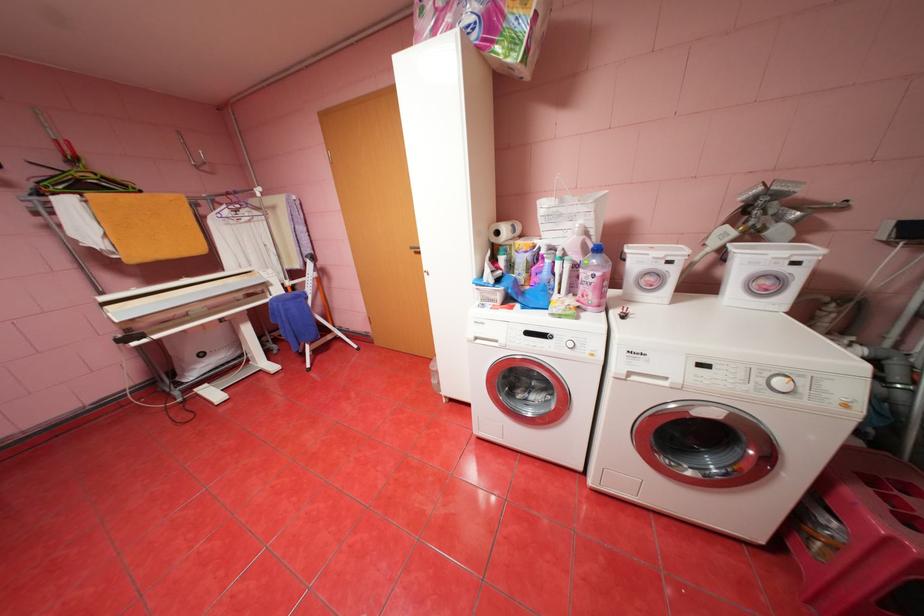
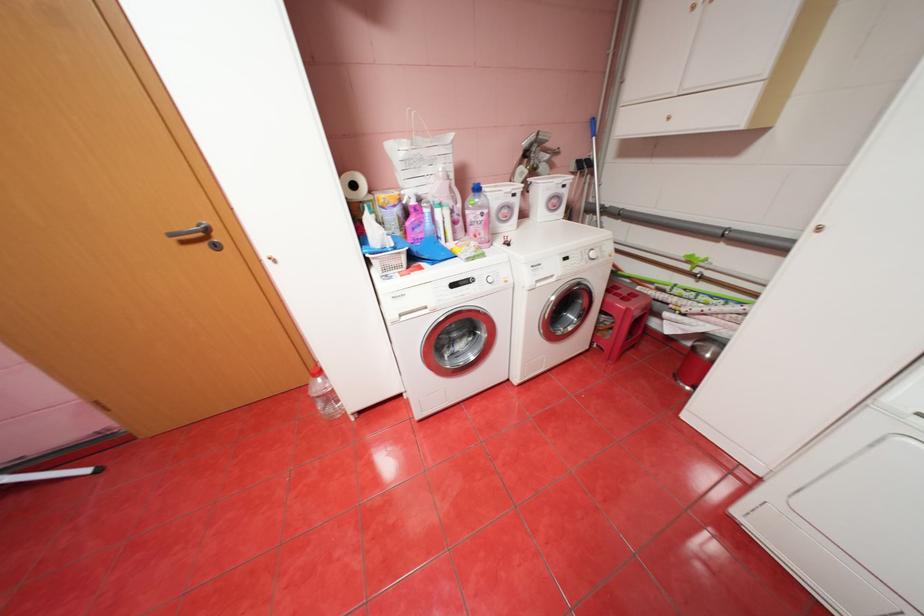
Question: The first image is from the beginning of the video and the second image is from the end. How did the camera likely rotate when shooting the video?

Choices:
 (A) Left
 (B) Right
 (C) Up
 (D) Down

Answer: (B)